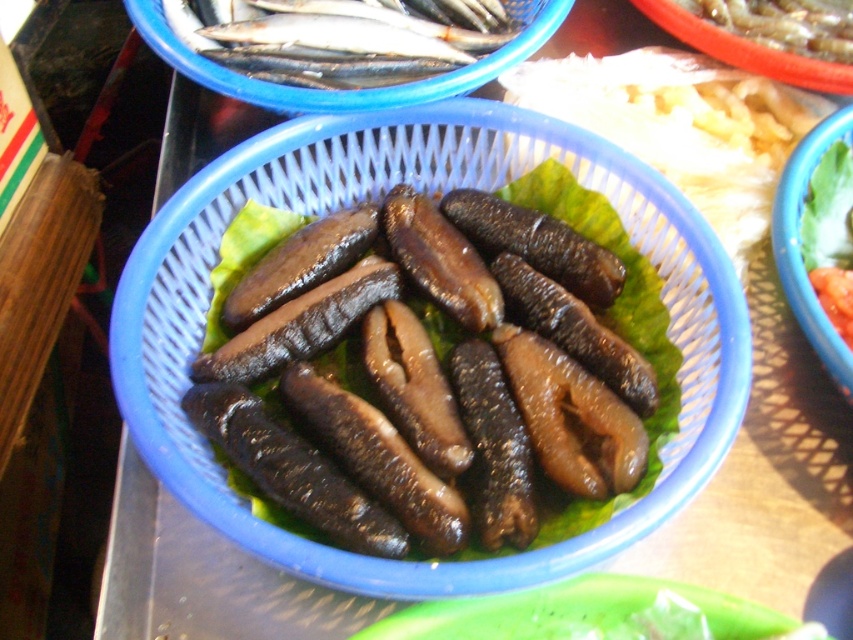
Is blue plastic basket at upper center above black matte sea cucumber at center?

Yes.

Does point (187, 72) come farther from viewer compared to point (605, 260)?

Yes, it is behind point (605, 260).

The image size is (853, 640). I want to click on blue plastic basket at upper center, so coord(354,90).

I want to click on blue plastic basket at upper center, so click(x=354, y=90).

Does black rubbery sea cucumber at center appear over shiny silver fish at upper center?

Actually, black rubbery sea cucumber at center is below shiny silver fish at upper center.

Can you confirm if black rubbery sea cucumber at center is positioned below shiny silver fish at upper center?

Yes.

Between point (257, 429) and point (405, 36), which one is positioned behind?

Point (405, 36)

Where is `black rubbery sea cucumber at center`? This screenshot has height=640, width=853. black rubbery sea cucumber at center is located at coordinates (427, 372).

Is black rubbery sea cucumber at center in front of black matte sea cucumber at center?

Yes, it is in front of black matte sea cucumber at center.

Is the position of black rubbery sea cucumber at center more distant than that of black matte sea cucumber at center?

No, it is not.

Between point (418, 268) and point (527, 256), which one is positioned behind?

Point (527, 256)

Where is `black rubbery sea cucumber at center`? This screenshot has height=640, width=853. black rubbery sea cucumber at center is located at coordinates (427, 372).